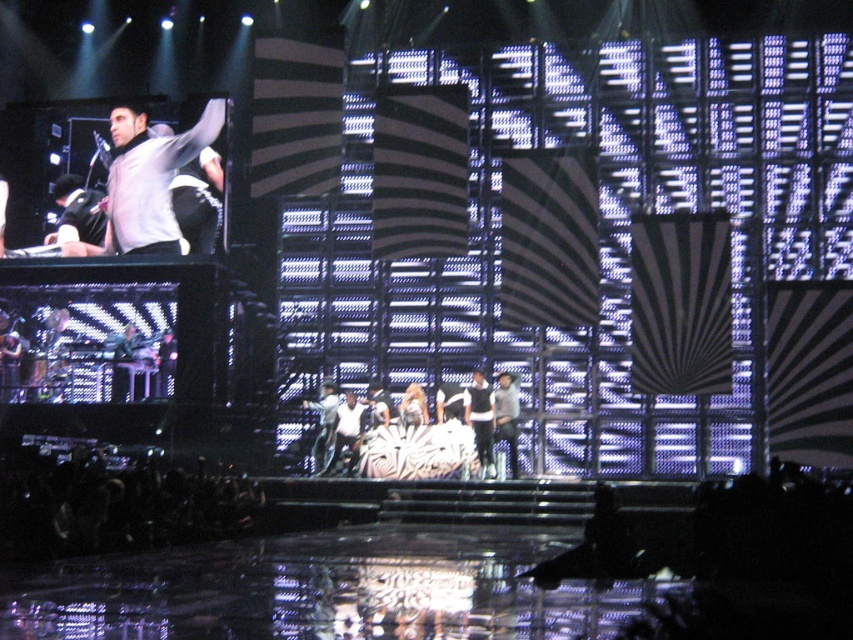
Is white fabric at center bigger than white cotton shirt at center?

Yes, white fabric at center is bigger than white cotton shirt at center.

Which is more to the left, white fabric at center or white cotton shirt at center?

white fabric at center is more to the left.

Image resolution: width=853 pixels, height=640 pixels. In order to click on white fabric at center in this screenshot , I will do `click(442, 433)`.

Locate an element on the screen. This screenshot has height=640, width=853. white fabric at center is located at coordinates (442, 433).

How distant is matte gray hoodie at upper left from white cotton shirt at center?

They are 25.77 meters apart.

In the scene shown: Is matte gray hoodie at upper left smaller than white cotton shirt at center?

No, matte gray hoodie at upper left is not smaller than white cotton shirt at center.

Is point (148, 168) farther from viewer compared to point (485, 394)?

Yes, it is.

Where is `matte gray hoodie at upper left`? The image size is (853, 640). matte gray hoodie at upper left is located at coordinates 149,179.

Does point (488, 472) come behind point (509, 394)?

That is False.

Which of these two, white cotton shirt at center or denim jeans at center, stands shorter?

white cotton shirt at center

Which is behind, point (477, 435) or point (503, 440)?

Positioned behind is point (503, 440).

Where is `white cotton shirt at center`? The image size is (853, 640). white cotton shirt at center is located at coordinates (480, 420).